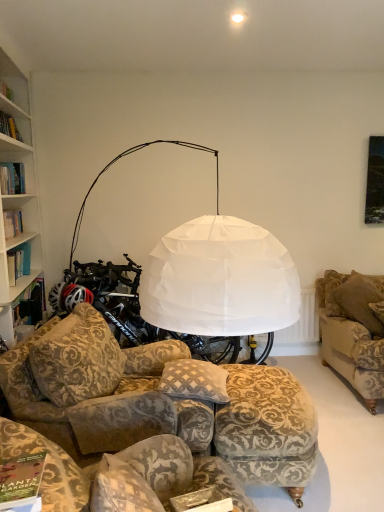
Image resolution: width=384 pixels, height=512 pixels. In order to click on free location above matte green book at lower left (from a real-world perspective) in this screenshot , I will do 20,478.